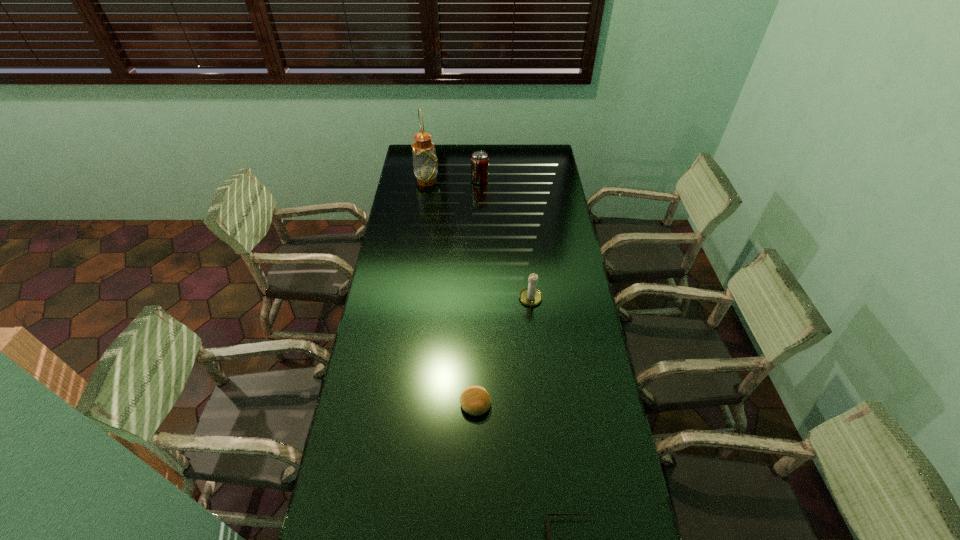
Locate an element on the screen. Image resolution: width=960 pixels, height=540 pixels. free space between the pop soda and the candle holder is located at coordinates (505, 240).

The height and width of the screenshot is (540, 960). Identify the location of vacant area between the leftmost object and the third farthest object. (479, 240).

Locate an element on the screen. object that is the fourth closest one to the shortest object is located at coordinates (479, 161).

Identify which object is located as the fourth nearest to the leftmost object. Please provide its 2D coordinates. Your answer should be formatted as a tuple, i.e. [(x, y)], where the tuple contains the x and y coordinates of a point satisfying the conditions above.

[(548, 523)]

Where is `free location that satisfies the following two spatial constraints: 1. on the front side of the fourth farthest object; 2. on the right side of the oil lamp`? free location that satisfies the following two spatial constraints: 1. on the front side of the fourth farthest object; 2. on the right side of the oil lamp is located at coordinates (395, 404).